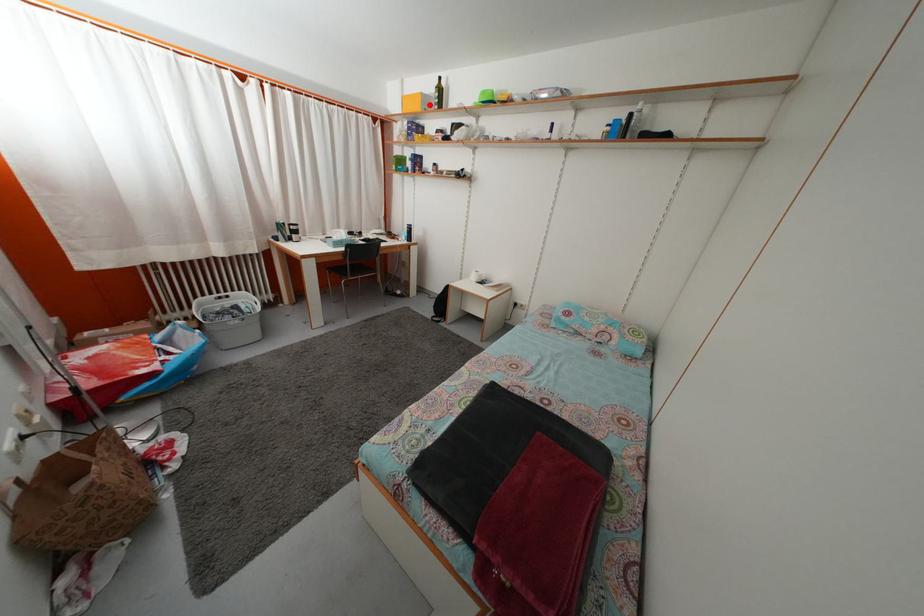
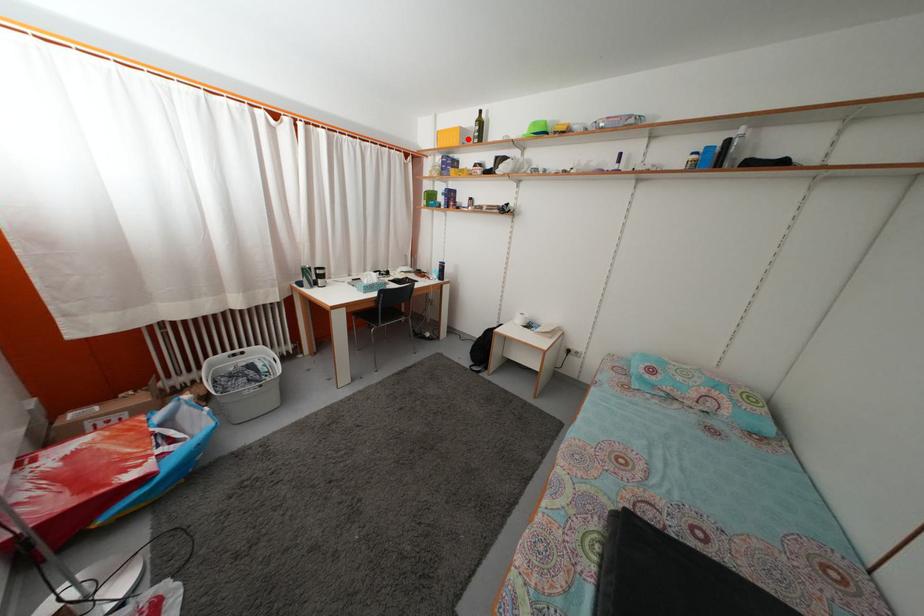
I am providing you with two images of the same scene from different viewpoints. A red point is marked on the first image and another point is marked on the second image. Is the red point in image1 aligned with the point shown in image2?

Yes